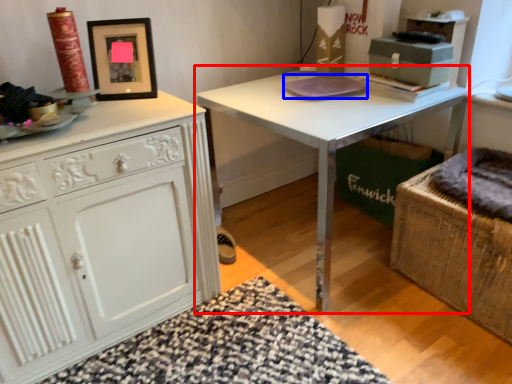
Question: Which point is closer to the camera, table (highlighted by a red box) or pad (highlighted by a blue box)?

Choices:
 (A) table
 (B) pad

Answer: (A)